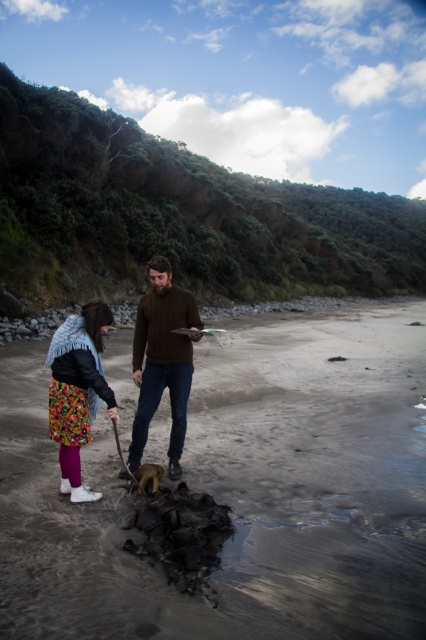
Question: Which point is farther to the camera?

Choices:
 (A) dark sand at center
 (B) brown knitted sweater at center
 (C) floral-patterned skirt at lower left

Answer: (B)

Question: Which point is closer to the camera taking this photo?

Choices:
 (A) (112, 362)
 (B) (57, 378)
 (C) (124, 470)

Answer: (B)

Question: Is dark sand at center smaller than brown knitted sweater at center?

Choices:
 (A) no
 (B) yes

Answer: (A)

Question: Estimate the real-world distances between objects in this image. Which object is farther from the brown knitted sweater at center?

Choices:
 (A) dark sand at center
 (B) floral-patterned skirt at lower left

Answer: (A)

Question: Does brown knitted sweater at center have a lesser width compared to floral-patterned skirt at lower left?

Choices:
 (A) yes
 (B) no

Answer: (A)

Question: Does brown knitted sweater at center appear over floral-patterned skirt at lower left?

Choices:
 (A) yes
 (B) no

Answer: (B)